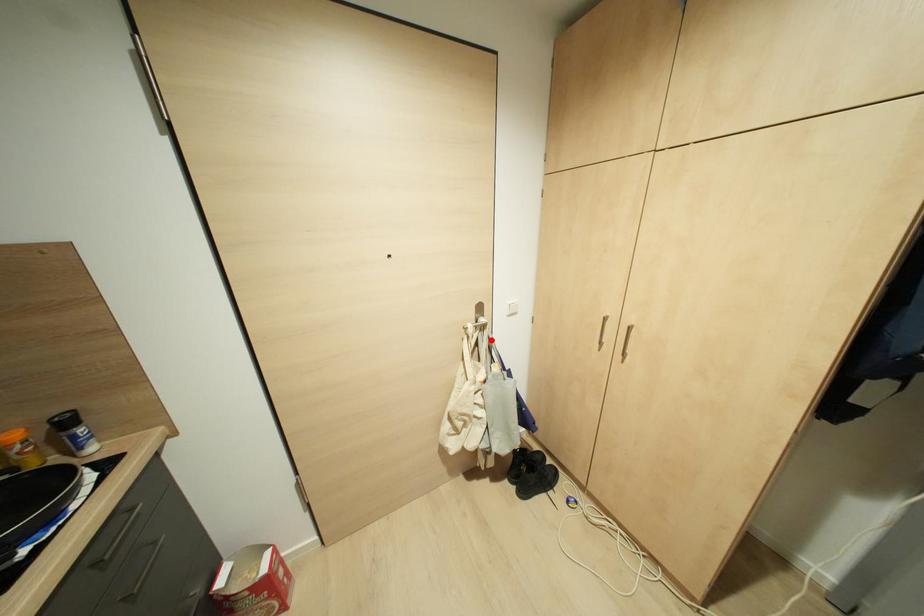
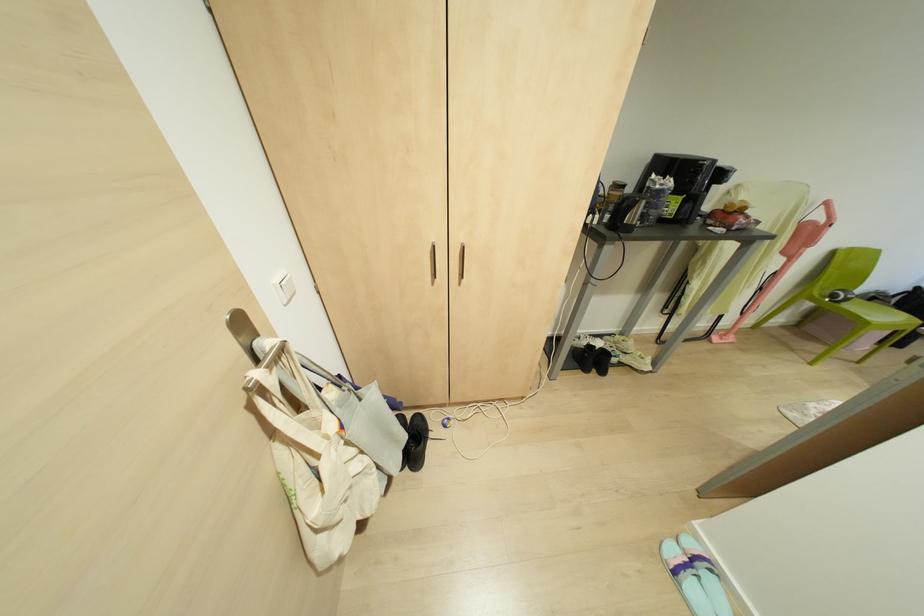
Locate, in the second image, the point that corresponds to the highlighted location in the first image.

(305, 362)